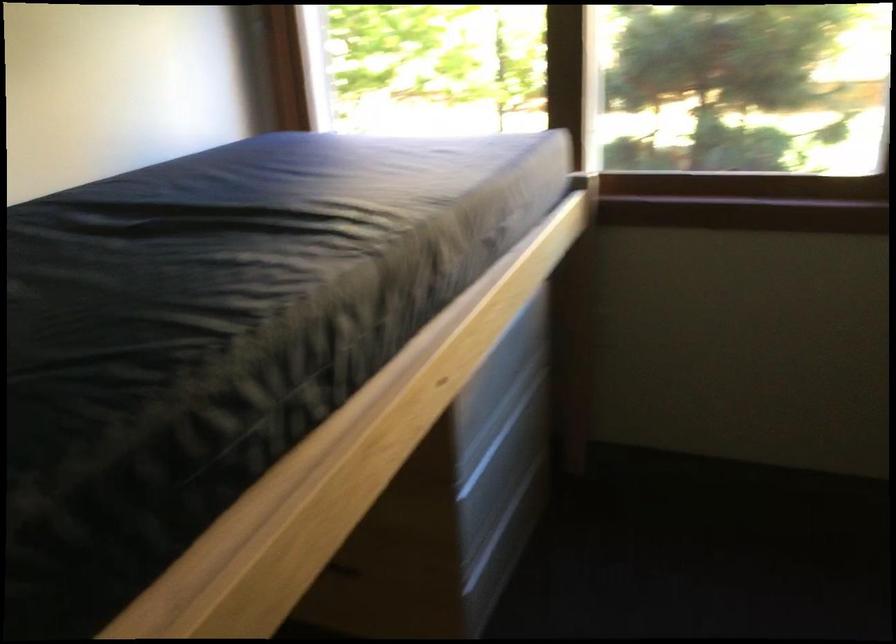
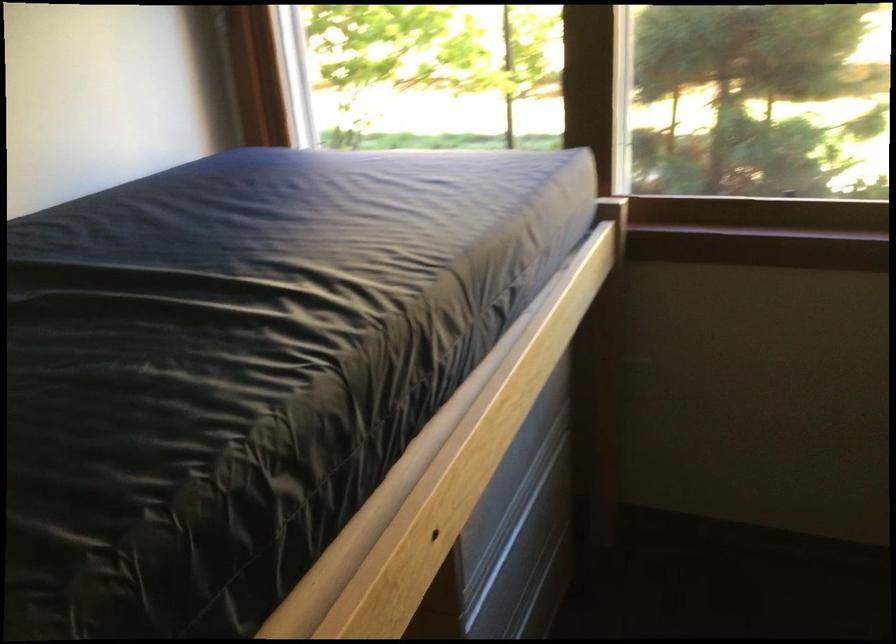
Locate, in the second image, the point that corresponds to (x=461, y=355) in the first image.

(467, 478)